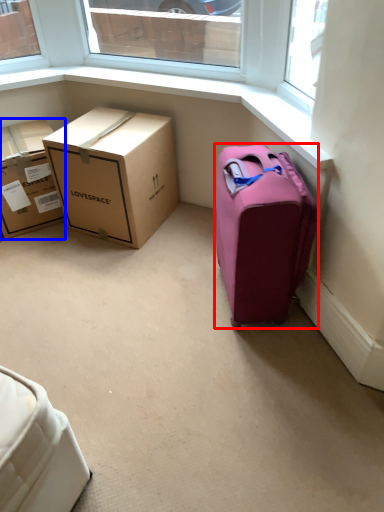
Question: Which object appears farthest to the camera in this image, suitcase (highlighted by a red box) or box (highlighted by a blue box)?

Choices:
 (A) suitcase
 (B) box

Answer: (B)